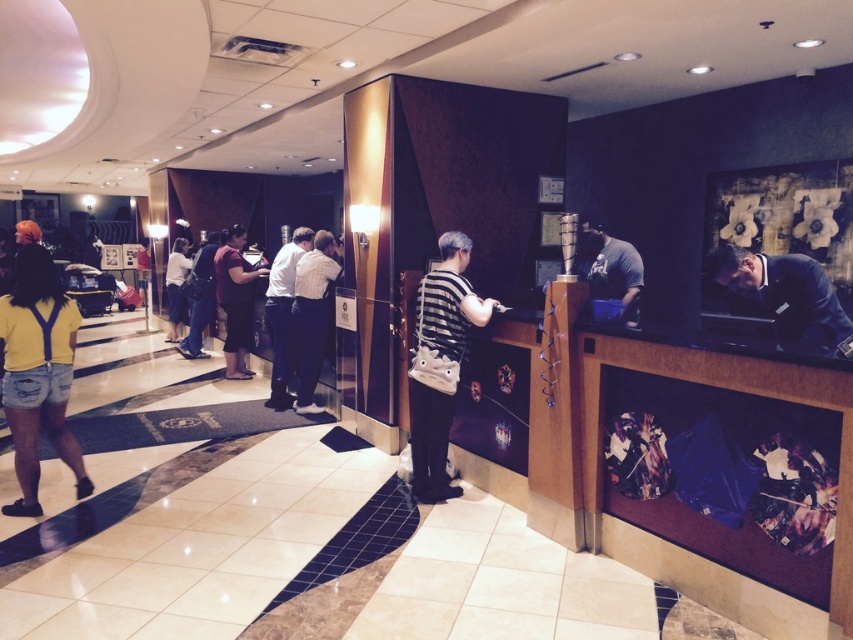
You are standing in the hotel lobby and want to approach the reception desk. Where should you head to find the dark gray shirt at center?

The dark gray shirt at center is located at the reception desk area behind the wooden desk, so you should head towards the reception desk on the right side of the lobby.

Based on the photo, you are a guest at the hotel and want to find the reception desk. You see the yellow denim shorts at lower left and the matte white blouse at center. Which object is closer to the reception desk?

The yellow denim shorts at lower left is closer to the reception desk because it is smaller in size compared to the matte white blouse at center, which might indicate it is positioned further away.